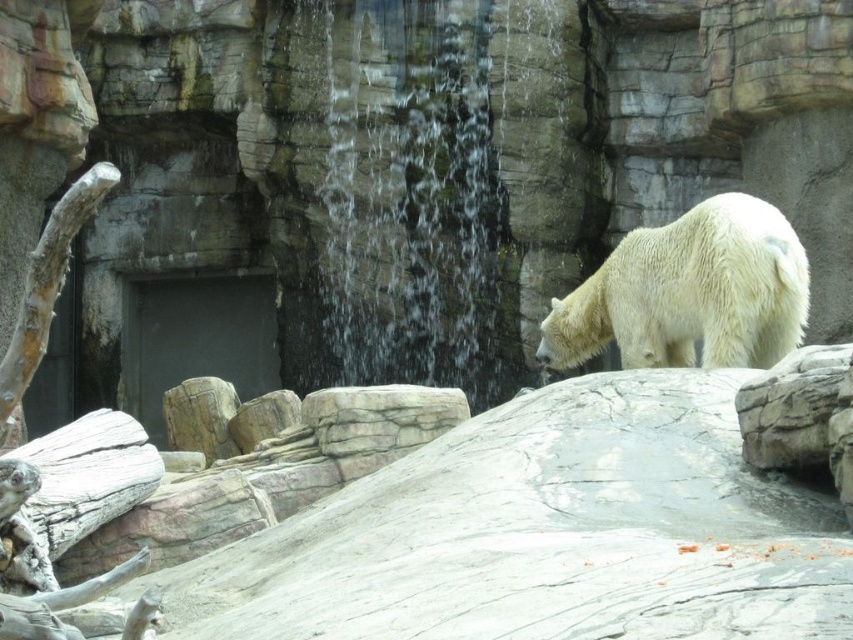
Can you confirm if clear water at center is wider than white fluffy bear at right?

Yes, clear water at center is wider than white fluffy bear at right.

Who is higher up, clear water at center or white fluffy bear at right?

clear water at center is higher up.

The height and width of the screenshot is (640, 853). What do you see at coordinates (415, 202) in the screenshot?
I see `clear water at center` at bounding box center [415, 202].

Identify the location of clear water at center. (415, 202).